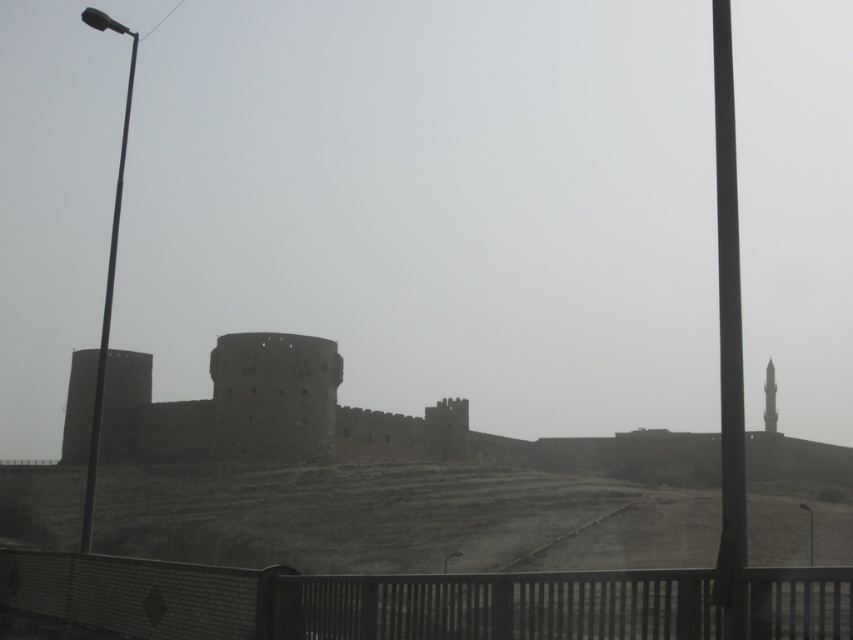
Question: Does brick fence at lower center have a smaller size compared to brown stone castle at center?

Choices:
 (A) no
 (B) yes

Answer: (B)

Question: Which point is closer to the camera?

Choices:
 (A) (45, 609)
 (B) (769, 401)

Answer: (A)

Question: Is brown stone castle at center above smooth stone minaret at center?

Choices:
 (A) no
 (B) yes

Answer: (B)

Question: In this image, where is brick fence at lower center located relative to smooth stone minaret at center?

Choices:
 (A) right
 (B) left

Answer: (B)

Question: Which point is closer to the camera?

Choices:
 (A) (704, 576)
 (B) (216, 422)

Answer: (A)

Question: Which object appears closest to the camera in this image?

Choices:
 (A) smooth stone minaret at center
 (B) brown stone castle at center

Answer: (B)